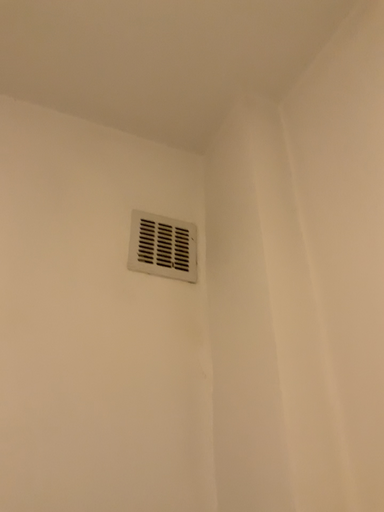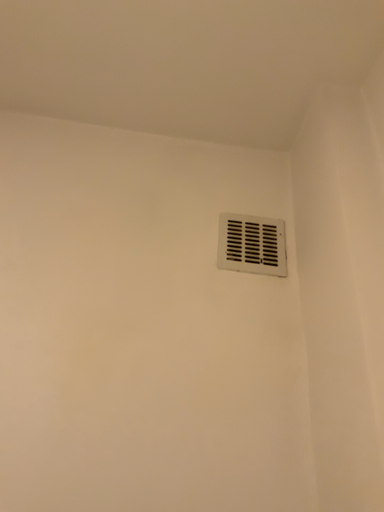
Question: Which way did the camera rotate in the video?

Choices:
 (A) rotated right
 (B) rotated left

Answer: (B)